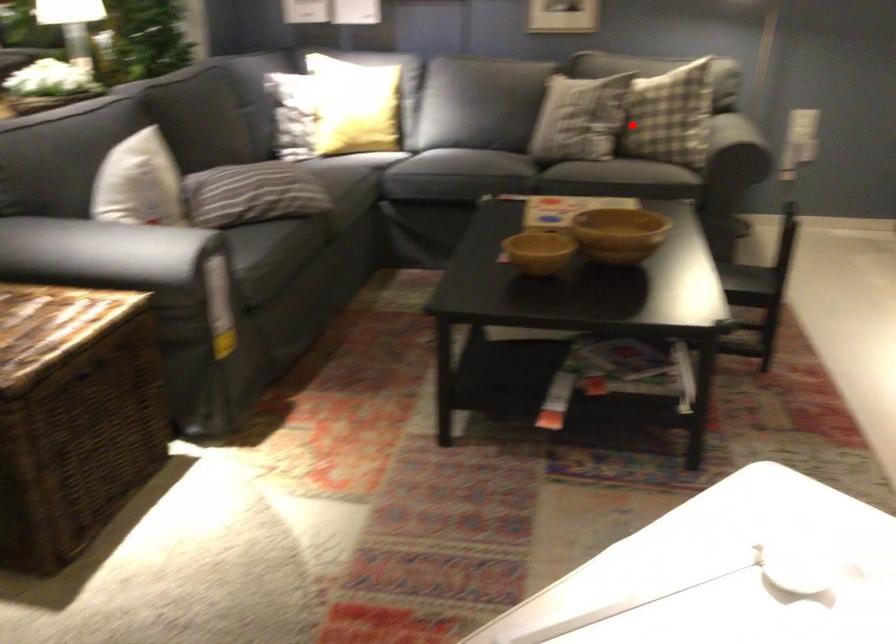
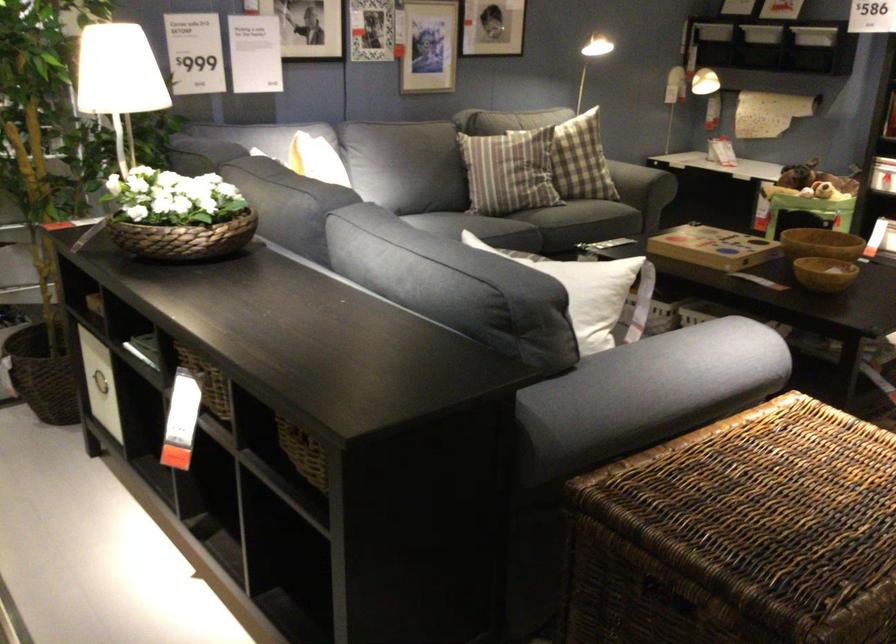
Question: I am providing you with two images of the same scene from different viewpoints. In image1, a red point is highlighted. Considering the same 3D point in image2, which of the following is correct?

Choices:
 (A) It is closer
 (B) It is farther

Answer: (B)